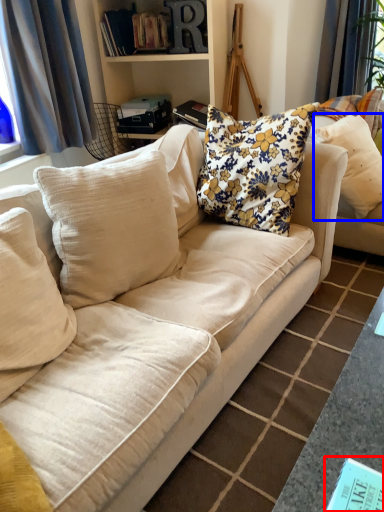
Question: Which object is further to the camera taking this photo, book (highlighted by a red box) or pillow (highlighted by a blue box)?

Choices:
 (A) book
 (B) pillow

Answer: (B)